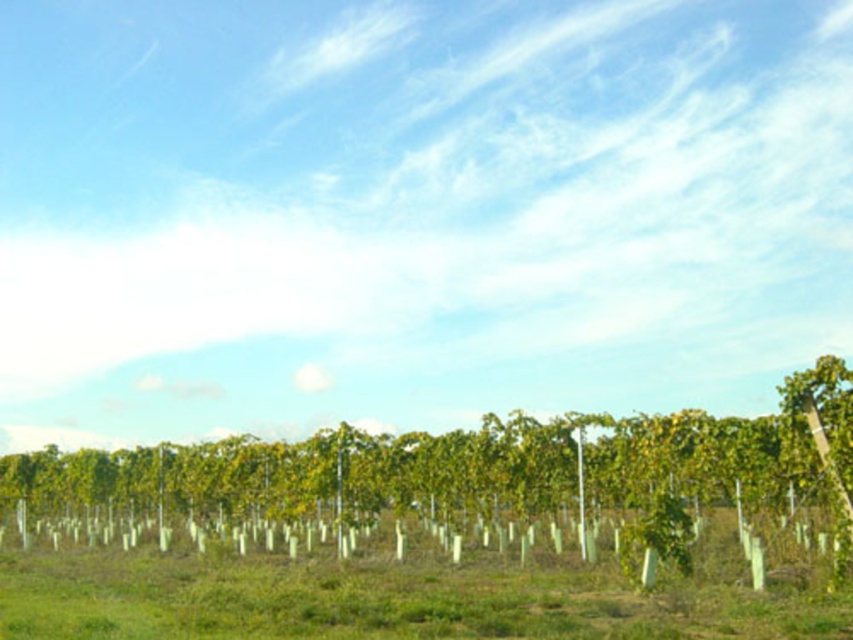
You are standing at the point marked by the coordinates point (482, 467) in the vineyard. What do you see directly in front of you?

At point 0.730, 0566 lies green leafy tree at center, so you would see the green leafy tree at center directly in front of you.

You are a gardener standing in the vineyard and want to water the green leafy plants at center and the green leafy tree at center. Which one should you water first if you want to reach the one closer to you first?

The green leafy tree at center is closer to you than the green leafy plants at center, so you should water the green leafy tree at center first.